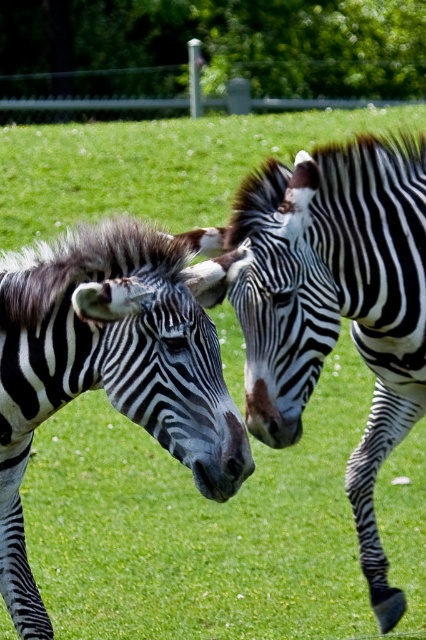
You are standing in the grassy field and want to walk towards the point that is closer to you. Which point should you walk towards, point [400,250] or point [132,406]?

You should walk towards point [132,406] because it is closer to you than point [400,250], which is further away.

You are a zookeeper observing two zebras in their enclosure. You notice the black and white striped zebra at center and the black and white striped zebra at left. Which zebra is positioned to the right of the other?

The black and white striped zebra at center is positioned to the right of the black and white striped zebra at left.